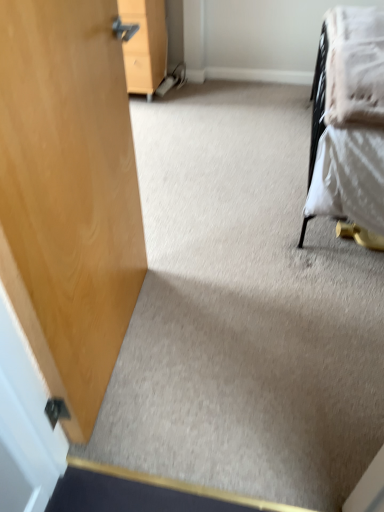
This screenshot has height=512, width=384. I want to click on wooden cabinet at upper left, so click(145, 45).

Image resolution: width=384 pixels, height=512 pixels. Describe the element at coordinates (145, 45) in the screenshot. I see `wooden cabinet at upper left` at that location.

What is the approximate width of wooden cabinet at upper left?

It is 46.04 centimeters.

This screenshot has height=512, width=384. Describe the element at coordinates (355, 66) in the screenshot. I see `white soft blanket at upper right` at that location.

The height and width of the screenshot is (512, 384). Identify the location of white soft blanket at upper right. (355, 66).

At what (x,y) coordinates should I click in order to perform the action: click on wooden cabinet at upper left. Please return your answer as a coordinate pair (x, y). Image resolution: width=384 pixels, height=512 pixels. Looking at the image, I should click on (145, 45).

Considering the relative positions of wooden cabinet at upper left and white soft blanket at upper right in the image provided, is wooden cabinet at upper left to the right of white soft blanket at upper right from the viewer's perspective?

No, wooden cabinet at upper left is not to the right of white soft blanket at upper right.

Based on the photo, which object is further away from the camera taking this photo, wooden cabinet at upper left or white soft blanket at upper right?

Positioned behind is wooden cabinet at upper left.

Between point (167, 42) and point (347, 12), which one is positioned behind?

The point (167, 42) is more distant.

From the image's perspective, between wooden cabinet at upper left and white soft blanket at upper right, which one is located above?

wooden cabinet at upper left appears higher in the image.

From a real-world perspective, who is located higher, wooden cabinet at upper left or white soft blanket at upper right?

white soft blanket at upper right is physically above.

Which object is thinner, wooden cabinet at upper left or white soft blanket at upper right?

white soft blanket at upper right.

Who is taller, wooden cabinet at upper left or white soft blanket at upper right?

wooden cabinet at upper left.

Who is smaller, wooden cabinet at upper left or white soft blanket at upper right?

Smaller between the two is white soft blanket at upper right.

Would you say white soft blanket at upper right is part of wooden cabinet at upper left's contents?

That's incorrect, white soft blanket at upper right is not inside wooden cabinet at upper left.

Is wooden cabinet at upper left far away from white soft blanket at upper right?

Yes, wooden cabinet at upper left and white soft blanket at upper right are located far from each other.

Looking at this image, is wooden cabinet at upper left oriented away from white soft blanket at upper right?

wooden cabinet at upper left is not turned away from white soft blanket at upper right.

Can you tell me how much wooden cabinet at upper left and white soft blanket at upper right differ in facing direction?

wooden cabinet at upper left and white soft blanket at upper right are facing 90.7 degrees away from each other.

At what (x,y) coordinates should I click in order to perform the action: click on blanket that is above the wooden cabinet at upper left (from a real-world perspective). Please return your answer as a coordinate pair (x, y). Looking at the image, I should click on (355, 66).

Which object is positioned more to the left, white soft blanket at upper right or wooden cabinet at upper left?

wooden cabinet at upper left is more to the left.

Which object is more forward, white soft blanket at upper right or wooden cabinet at upper left?

white soft blanket at upper right is more forward.

Is point (333, 51) behind point (120, 11)?

No, (333, 51) is in front of (120, 11).

From the image's perspective, is white soft blanket at upper right on top of wooden cabinet at upper left?

No, from the image's perspective, white soft blanket at upper right is not above wooden cabinet at upper left.

From a real-world perspective, which object stands above the other?

In real-world perspective, white soft blanket at upper right is above.

Can you confirm if white soft blanket at upper right is wider than wooden cabinet at upper left?

No.

Considering the sizes of objects white soft blanket at upper right and wooden cabinet at upper left in the image provided, who is shorter, white soft blanket at upper right or wooden cabinet at upper left?

Standing shorter between the two is white soft blanket at upper right.

Which of these two, white soft blanket at upper right or wooden cabinet at upper left, is bigger?

wooden cabinet at upper left is bigger.

Consider the image. Is white soft blanket at upper right surrounding wooden cabinet at upper left?

No, wooden cabinet at upper left is not surrounded by white soft blanket at upper right.

Is white soft blanket at upper right touching wooden cabinet at upper left?

No, white soft blanket at upper right is not next to wooden cabinet at upper left.

Is white soft blanket at upper right aimed at wooden cabinet at upper left?

No, white soft blanket at upper right is not aimed at wooden cabinet at upper left.

How different are the orientations of white soft blanket at upper right and wooden cabinet at upper left in degrees?

The angle between the facing direction of white soft blanket at upper right and the facing direction of wooden cabinet at upper left is 90.7 degrees.

Measure the distance from white soft blanket at upper right to wooden cabinet at upper left.

They are 4.16 feet apart.

Identify the location of blanket in front of the wooden cabinet at upper left. (355, 66).

At what (x,y) coordinates should I click in order to perform the action: click on blanket above the wooden cabinet at upper left (from a real-world perspective). Please return your answer as a coordinate pair (x, y). The image size is (384, 512). Looking at the image, I should click on (355, 66).

The height and width of the screenshot is (512, 384). I want to click on furniture that appears below the white soft blanket at upper right (from a real-world perspective), so click(x=145, y=45).